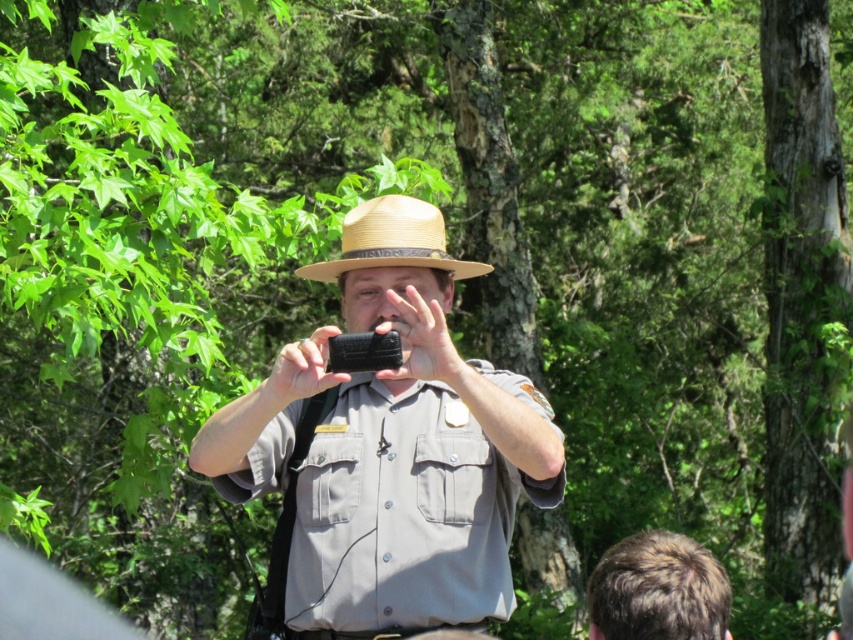
Question: Does brown hair at lower right have a smaller size compared to natural straw cowboy hat at center?

Choices:
 (A) yes
 (B) no

Answer: (A)

Question: Can you confirm if gray matte uniform at center is wider than brown hair at lower right?

Choices:
 (A) yes
 (B) no

Answer: (A)

Question: Which point appears farthest from the camera in this image?

Choices:
 (A) (639, 605)
 (B) (428, 241)
 (C) (363, 634)

Answer: (B)

Question: Estimate the real-world distances between objects in this image. Which object is farther from the brown hair at lower right?

Choices:
 (A) gray matte uniform at center
 (B) natural straw cowboy hat at center

Answer: (B)

Question: Which is farther from the brown hair at lower right?

Choices:
 (A) gray matte uniform at center
 (B) natural straw cowboy hat at center

Answer: (B)

Question: Is brown hair at lower right thinner than natural straw cowboy hat at center?

Choices:
 (A) no
 (B) yes

Answer: (B)